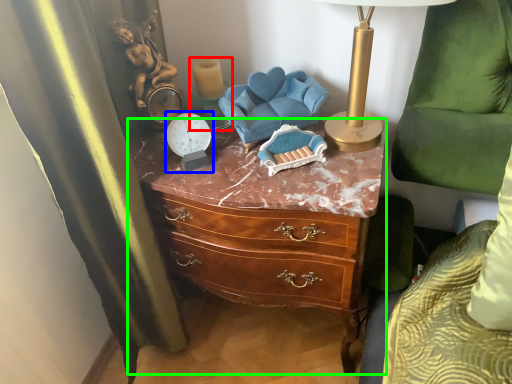
Question: Considering the real-world distances, which object is closest to candle holder (highlighted by a red box)? clock (highlighted by a blue box) or chest of drawers (highlighted by a green box).

Choices:
 (A) clock
 (B) chest of drawers

Answer: (A)